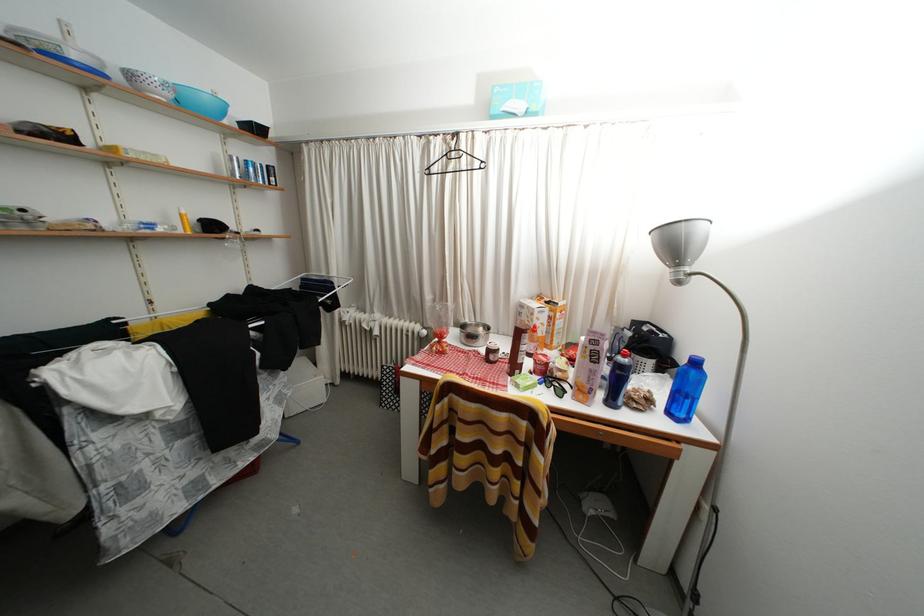
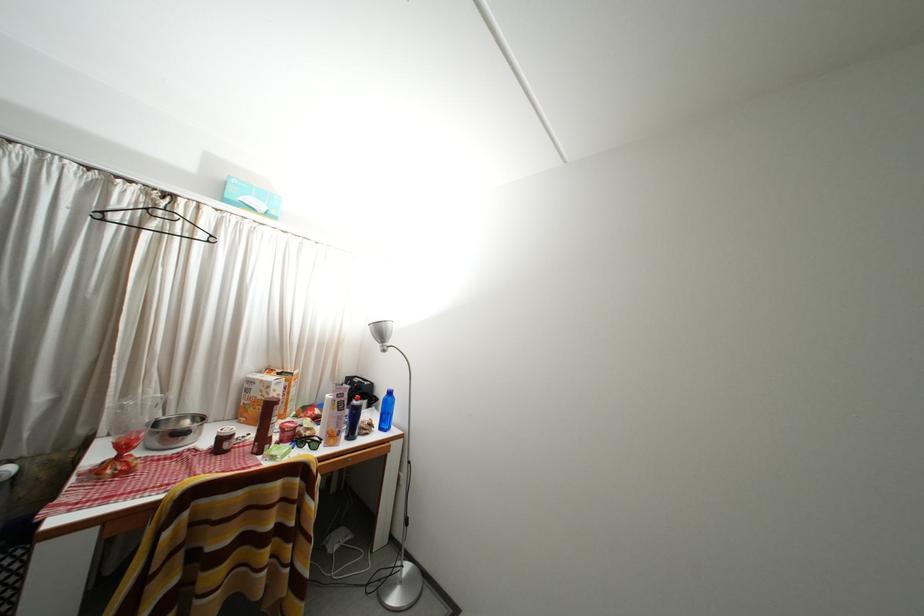
Where in the second image is the point corresponding to the point at 669,406 from the first image?

(383, 428)